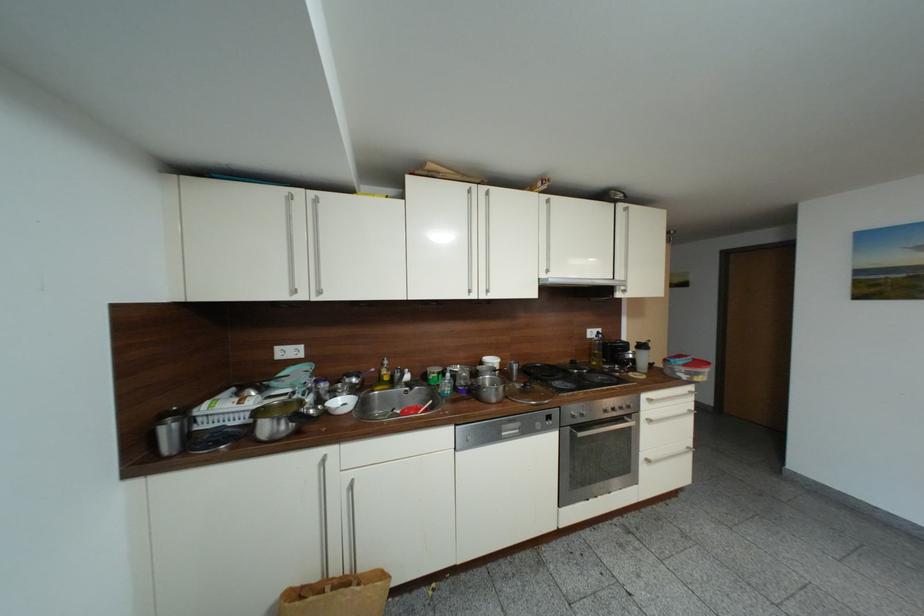
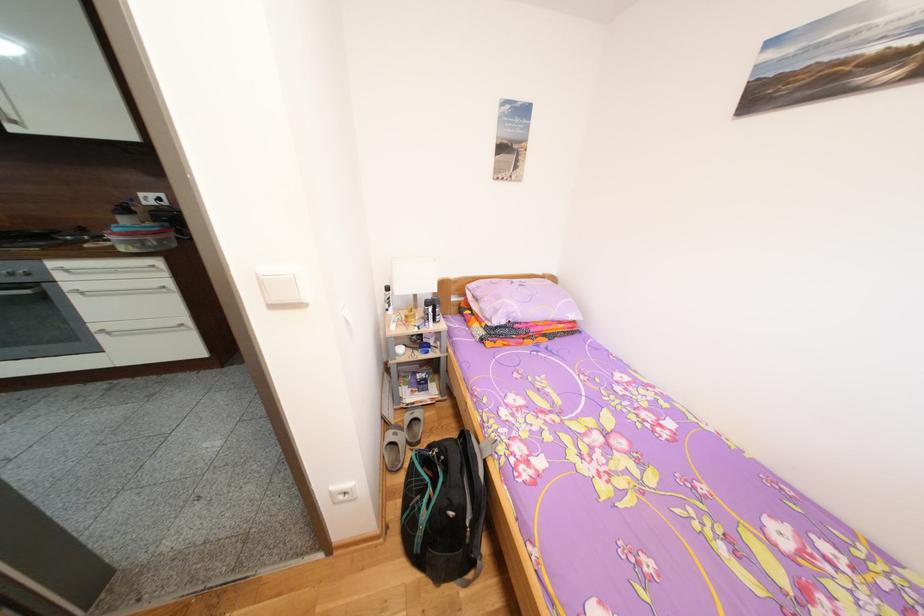
Question: Which direction would the cameraman need to move to produce the second image? Reply with the corresponding letter.

Choices:
 (A) Left
 (B) Right
 (C) Forward
 (D) Backward

Answer: (B)